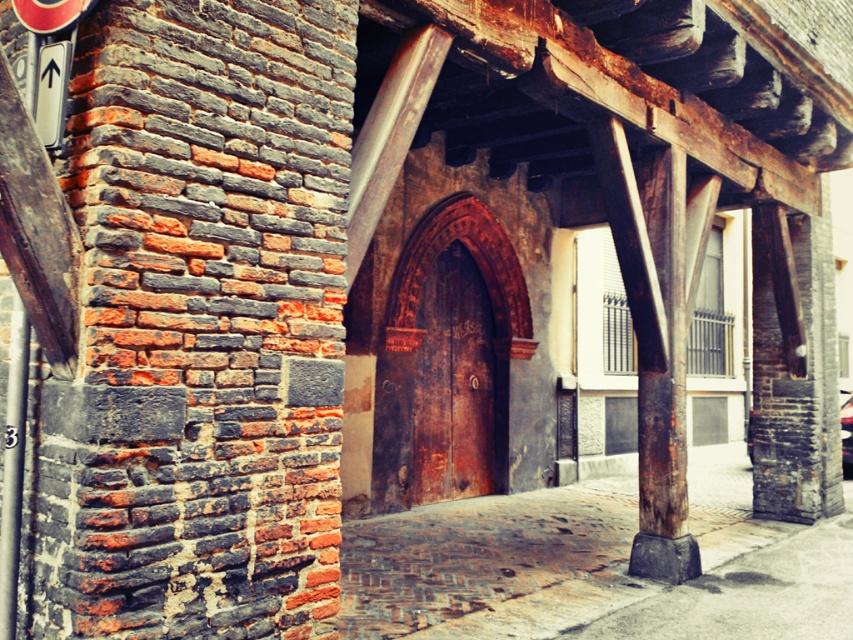
Question: Which object is positioned farthest from the metallic silver car at center?

Choices:
 (A) white plastic sign at upper left
 (B) metallic gray pole at left
 (C) rustic stone pavement at center

Answer: (B)

Question: Is metallic gray pole at left to the right of metallic silver car at center from the viewer's perspective?

Choices:
 (A) yes
 (B) no

Answer: (B)

Question: Estimate the real-world distances between objects in this image. Which object is farther from the metallic silver car at center?

Choices:
 (A) white plastic sign at upper left
 (B) metallic gray pole at left

Answer: (B)

Question: Is rustic stone pavement at center further to camera compared to metallic silver car at center?

Choices:
 (A) no
 (B) yes

Answer: (A)

Question: Which point appears farthest from the camera in this image?

Choices:
 (A) (42, 141)
 (B) (9, 428)
 (C) (850, 436)
 (D) (372, 602)

Answer: (C)

Question: Can you confirm if metallic gray pole at left is positioned to the right of metallic silver car at center?

Choices:
 (A) yes
 (B) no

Answer: (B)